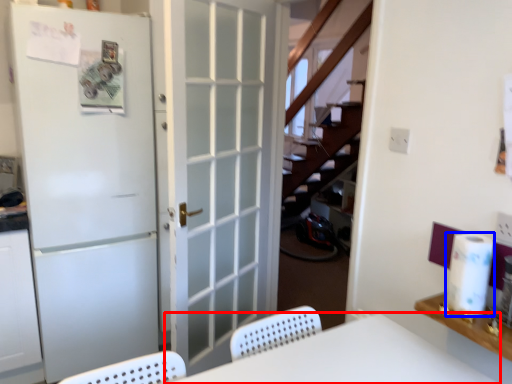
Question: Which object appears farthest to the camera in this image, furniture (highlighted by a red box) or paper towel (highlighted by a blue box)?

Choices:
 (A) furniture
 (B) paper towel

Answer: (B)